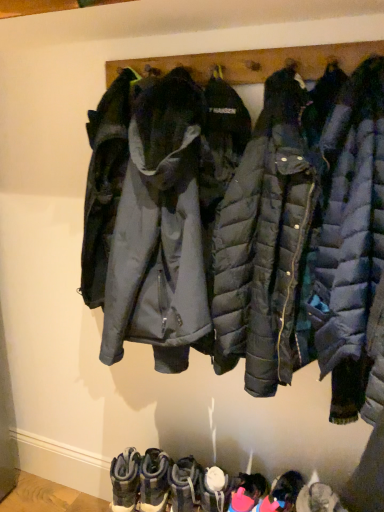
Question: Visually, is matte black puffer jacket at center positioned to the left or to the right of leather suede boots at lower center, which ranks as the fifth footwear in right-to-left order?

Choices:
 (A) right
 (B) left

Answer: (A)

Question: Would you say matte black puffer jacket at center is inside or outside leather suede boots at lower center, which is the 2th footwear in left-to-right order?

Choices:
 (A) outside
 (B) inside

Answer: (A)

Question: Which object is positioned closest to the leather suede boots at lower center, which ranks as the fifth footwear in right-to-left order?

Choices:
 (A) camouflage suede boots at lower center, positioned as the sixth footwear in right-to-left order
 (B) pink fabric boot at lower center, which ranks as the second footwear in right-to-left order
 (C) matte black puffer jacket at center
 (D) leather suede boots at lower center, which is the 3th footwear from left to right
 (E) pink fabric boots at lower center, which is the 1th footwear from right to left

Answer: (A)

Question: Which object is the farthest from the pink fabric boots at lower center, arranged as the sixth footwear when viewed from the left?

Choices:
 (A) matte black puffer jacket at center
 (B) pink fabric boot at lower center, which ranks as the second footwear in right-to-left order
 (C) leather suede boots at lower center, which is the 2th footwear in left-to-right order
 (D) camouflage suede boots at lower center, positioned as the sixth footwear in right-to-left order
 (E) leather suede boots at lower center, the fourth footwear from the right

Answer: (A)